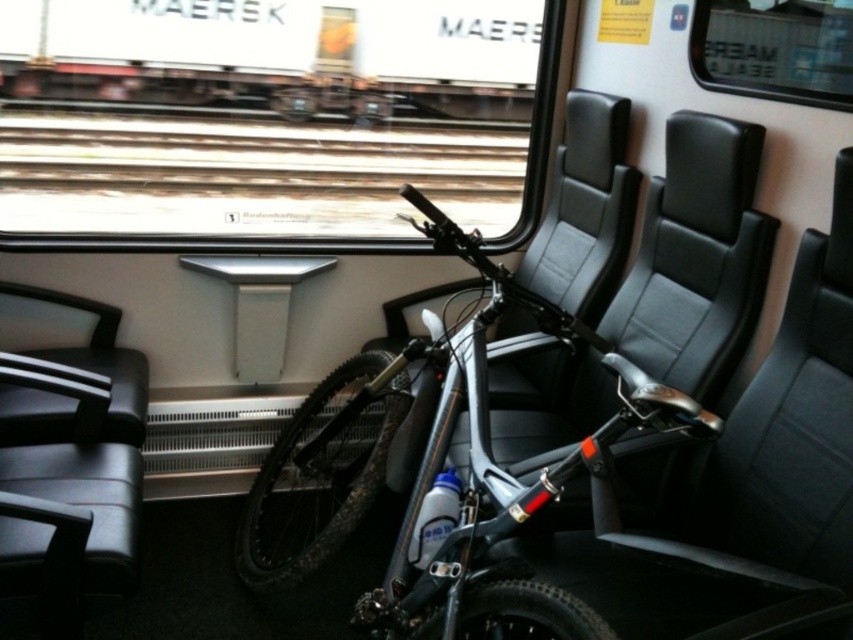
Is silver metallic bicycle at center to the right of black leather chair at left from the viewer's perspective?

Yes, silver metallic bicycle at center is to the right of black leather chair at left.

Based on the photo, between silver metallic bicycle at center and black leather chair at left, which one has more height?

silver metallic bicycle at center

I want to click on silver metallic bicycle at center, so click(328, 472).

Between point (292, 566) and point (759, 83), which one is positioned in front?

Point (759, 83)

Locate an element on the screen. This screenshot has height=640, width=853. silver metallic bicycle at center is located at coordinates (328, 472).

Which is behind, point (798, 276) or point (813, 96)?

Positioned behind is point (813, 96).

The height and width of the screenshot is (640, 853). Find the location of `black leather chair at center`. black leather chair at center is located at coordinates (762, 481).

Where is `black leather chair at center`? black leather chair at center is located at coordinates (762, 481).